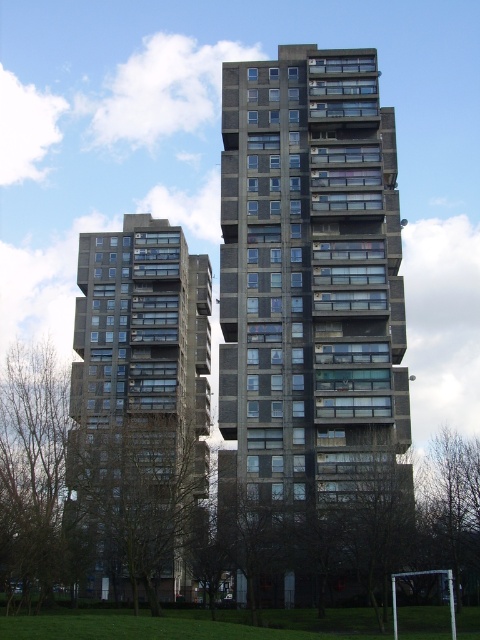
Question: Is concrete block building at center further to the viewer compared to dark gray concrete building at left?

Choices:
 (A) yes
 (B) no

Answer: (A)

Question: Can you confirm if concrete block building at center is thinner than dark gray concrete building at left?

Choices:
 (A) no
 (B) yes

Answer: (B)

Question: Which object is farther from the camera taking this photo?

Choices:
 (A) dark gray concrete building at left
 (B) concrete block building at center

Answer: (B)

Question: Can you confirm if concrete block building at center is positioned above dark gray concrete building at left?

Choices:
 (A) no
 (B) yes

Answer: (B)